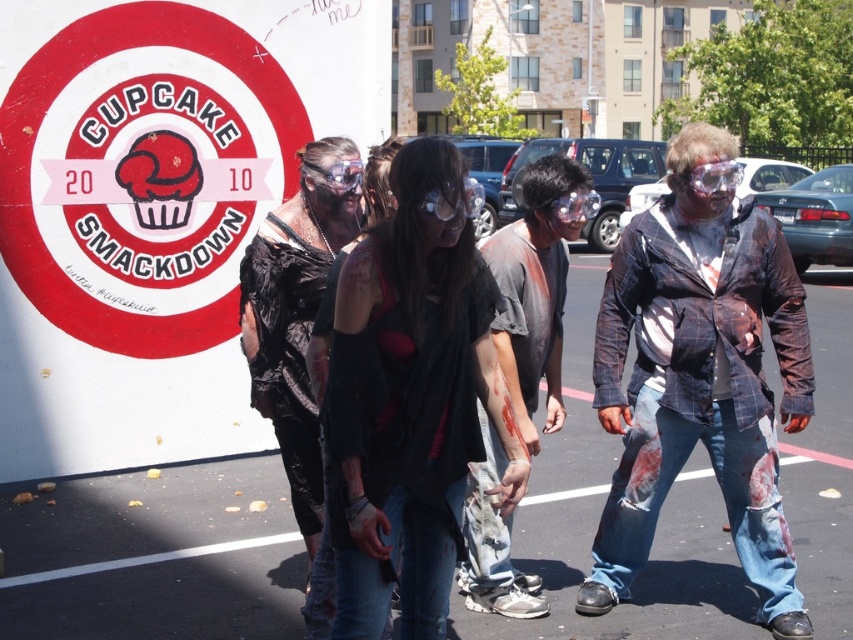
Is distressed denim jeans at center shorter than black plastic bag at center?

No, distressed denim jeans at center is not shorter than black plastic bag at center.

Who is more forward, (x=494, y=264) or (x=308, y=262)?

Point (x=308, y=262)

I want to click on distressed denim jeans at center, so click(537, 285).

Is point (762, 214) closer to viewer compared to point (357, 522)?

No, it is not.

Between point (798, 344) and point (392, 326), which one is positioned in front?

Point (392, 326) is more forward.

Locate an element on the screen. This screenshot has width=853, height=640. distressed denim jacket at center is located at coordinates (700, 372).

Looking at this image, who is positioned more to the left, distressed denim jacket at center or distressed denim jeans at center?

distressed denim jeans at center

Based on the photo, can you confirm if distressed denim jacket at center is positioned below distressed denim jeans at center?

No, distressed denim jacket at center is not below distressed denim jeans at center.

What are the coordinates of `distressed denim jacket at center` in the screenshot? It's located at (700, 372).